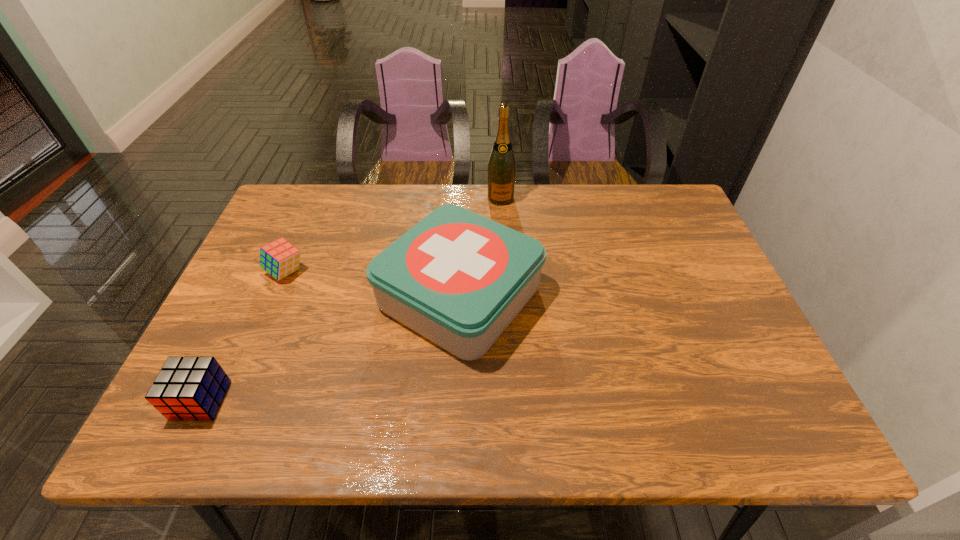
Locate an element on the screen. the tallest object is located at coordinates click(x=501, y=167).

Where is `the farthest object`? the farthest object is located at coordinates (501, 167).

This screenshot has height=540, width=960. Identify the location of the first-aid kit. (457, 278).

The width and height of the screenshot is (960, 540). I want to click on the farther cube, so click(x=280, y=258).

Locate an element on the screen. The image size is (960, 540). the nearer cube is located at coordinates (191, 388).

The height and width of the screenshot is (540, 960). I want to click on free space located on the front-facing side of the wine bottle, so click(505, 276).

Where is `blank area located 0.180m on the left of the first-aid kit`? This screenshot has width=960, height=540. blank area located 0.180m on the left of the first-aid kit is located at coordinates (304, 296).

Identify the location of free point located on the right of the farther cube. (364, 272).

You are a GUI agent. You are given a task and a screenshot of the screen. Output one action in this format:
    pyautogui.click(x=<x>, y=<y>)
    Task: Click on the vacant area situated on the right of the nearest object
    The image size is (960, 540).
    Given the screenshot: What is the action you would take?
    pyautogui.click(x=351, y=400)

Locate an element on the screen. object located at the far edge is located at coordinates (501, 167).